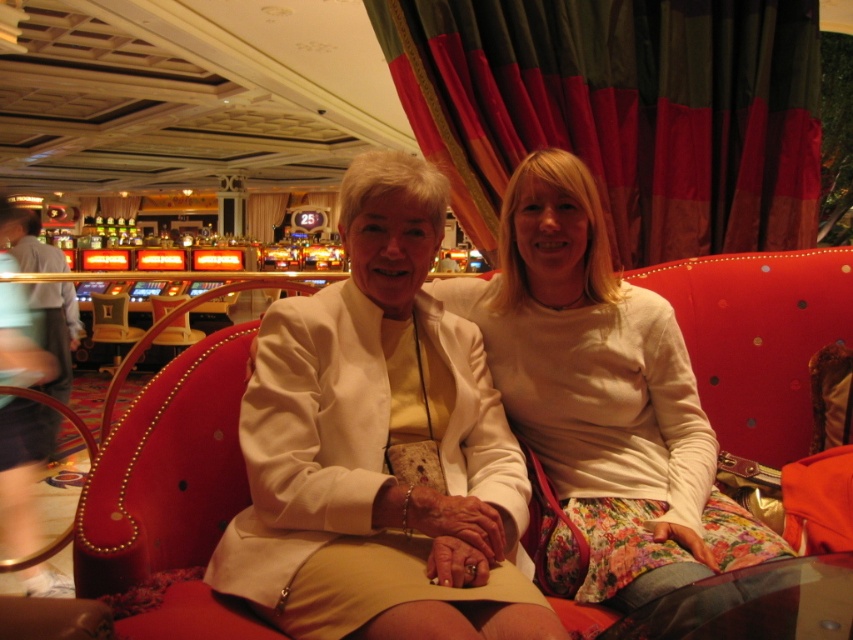
You are standing in a luxurious setting with slot machines in the background. You notice two people sitting on a red sofa holding hands. There is a point marked at coordinates (622, 112). What object is located at this point?

The point at coordinates (622, 112) indicates a velvet like curtain at upper center.

You are a photographer standing in front of the sofa where the two individuals are seated. You want to place a white cotton sweater at center on the sofa to take a photo. According to the scene description, where should you place the sweater?

Place the white cotton sweater at center at the coordinates point (601, 401).